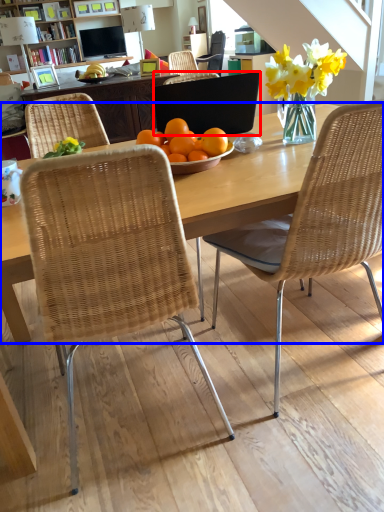
Question: Which point is further to the camera, laptop (highlighted by a red box) or desk (highlighted by a blue box)?

Choices:
 (A) laptop
 (B) desk

Answer: (A)